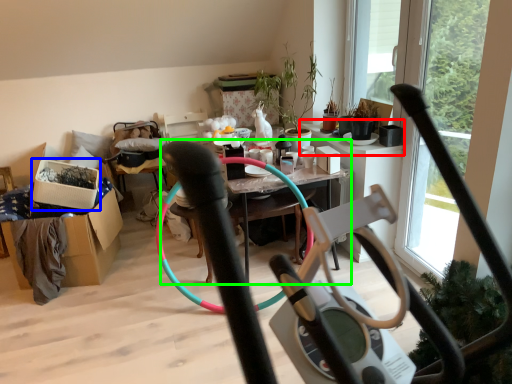
Question: Which object is positioned farthest from window sill (highlighted by a red box)? Select from box (highlighted by a blue box) and table (highlighted by a green box).

Choices:
 (A) box
 (B) table

Answer: (B)